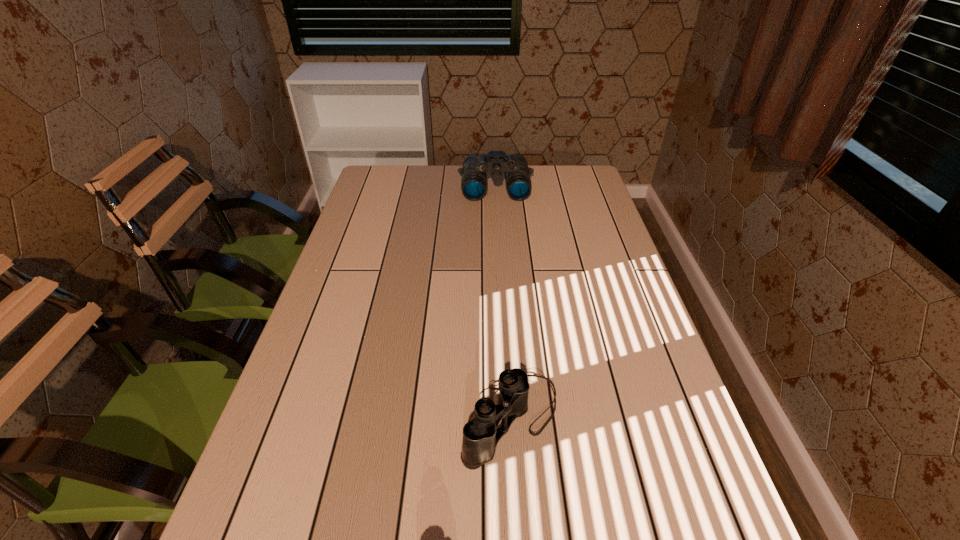
This screenshot has width=960, height=540. Identify the location of empty space between the nearer binoculars and the farther binoculars. (503, 301).

Where is `free space between the nearer binoculars and the farther binoculars`? free space between the nearer binoculars and the farther binoculars is located at coordinates (503, 301).

What are the coordinates of `free area in between the farther binoculars and the nearer binoculars` in the screenshot? It's located at (503, 301).

At what (x,y) coordinates should I click in order to perform the action: click on empty location between the farther binoculars and the nearer object. Please return your answer as a coordinate pair (x, y). The image size is (960, 540). Looking at the image, I should click on (503, 301).

Find the location of a particular element. free space that satisfies the following two spatial constraints: 1. through the lenses of the farther object; 2. on the right side of the nearer object is located at coordinates (508, 416).

This screenshot has height=540, width=960. I want to click on blank area in the image that satisfies the following two spatial constraints: 1. through the lenses of the nearer object; 2. on the left side of the farther binoculars, so click(x=508, y=416).

Find the location of a particular element. This screenshot has height=540, width=960. vacant space that satisfies the following two spatial constraints: 1. through the lenses of the nearer object; 2. on the right side of the farther binoculars is located at coordinates (508, 416).